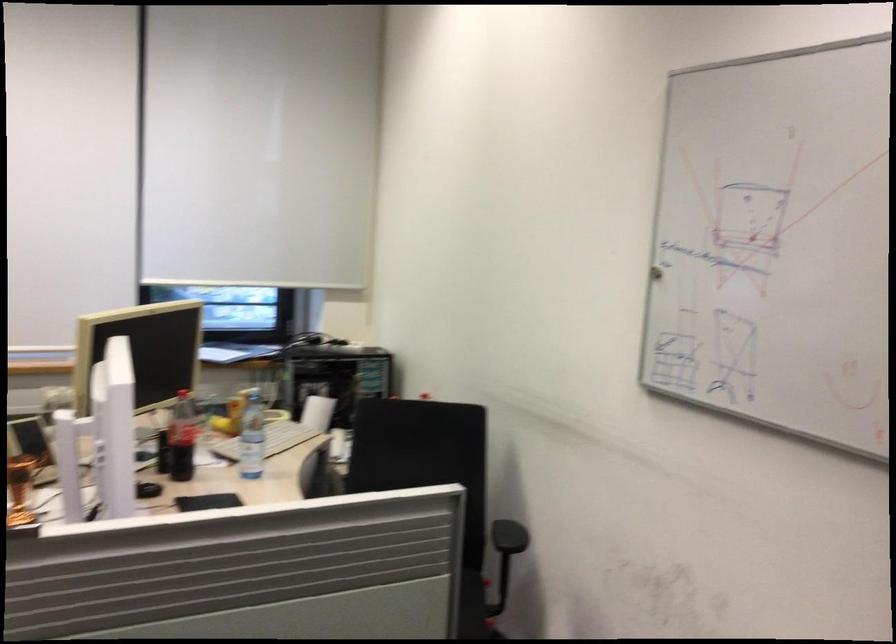
What do you see at coordinates (20, 489) in the screenshot?
I see `the copper-colored cup` at bounding box center [20, 489].